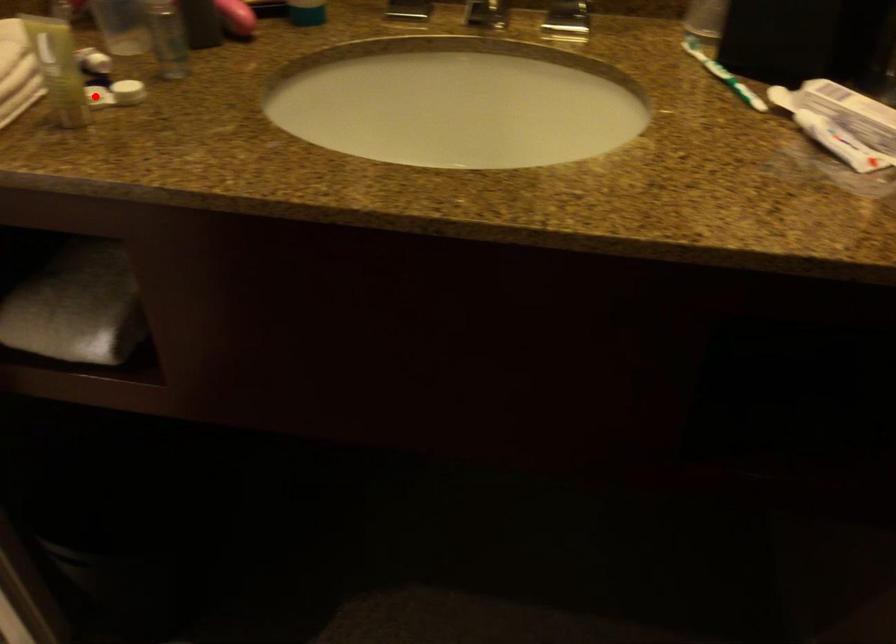
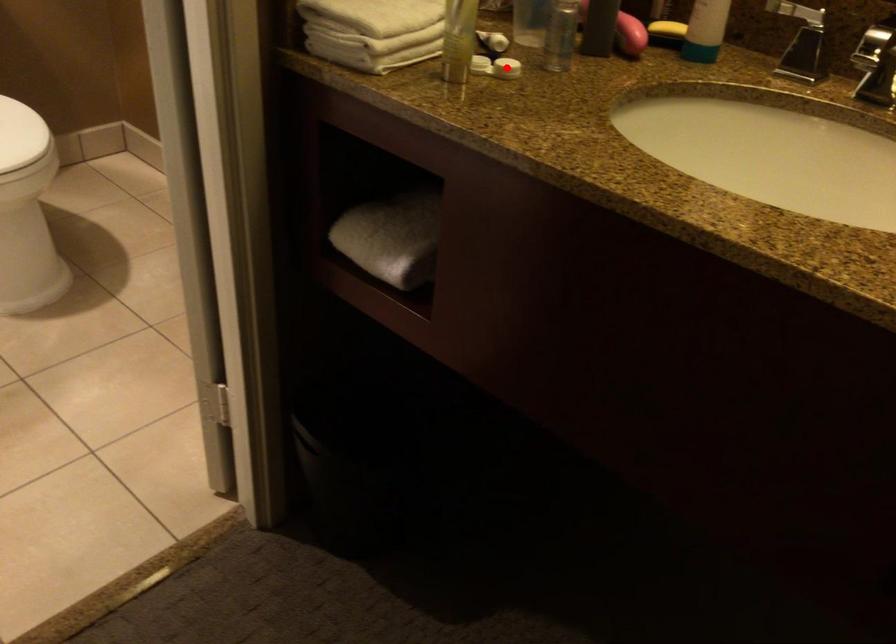
From the picture: I am providing you with two images of the same scene from different viewpoints. A red point is marked on the first image and another point is marked on the second image. Is the red point in image1 aligned with the point shown in image2?

No